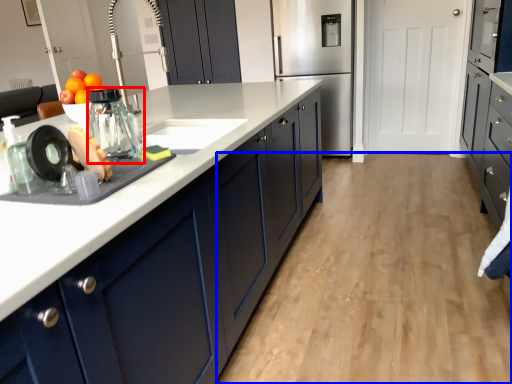
Question: Which object is further to the camera taking this photo, appliance (highlighted by a red box) or plain (highlighted by a blue box)?

Choices:
 (A) appliance
 (B) plain

Answer: (B)